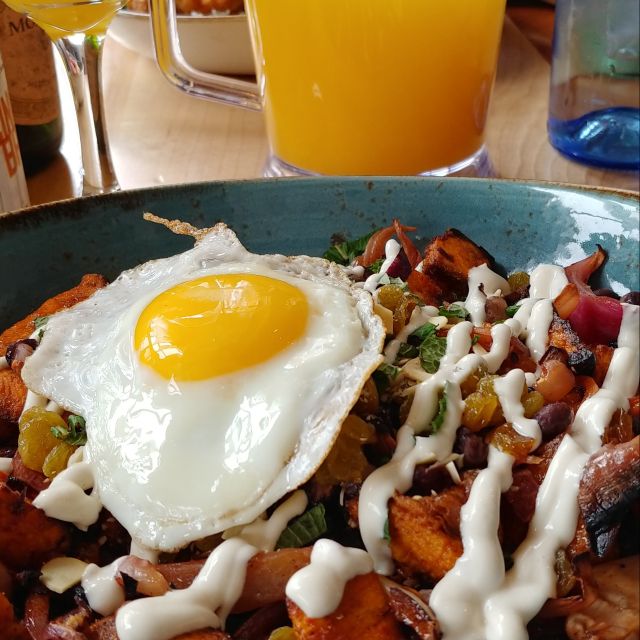
Identify the location of wooden table. (179, 156).